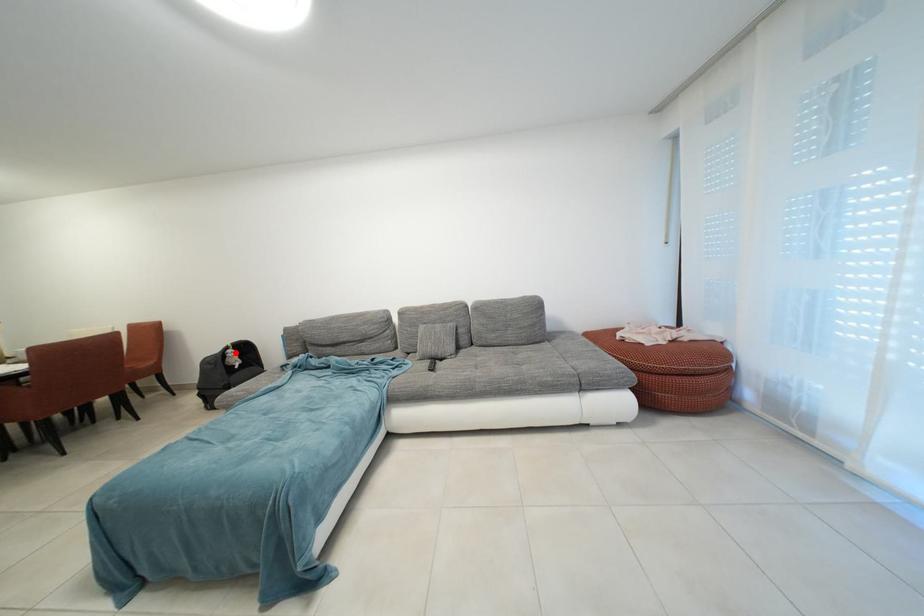
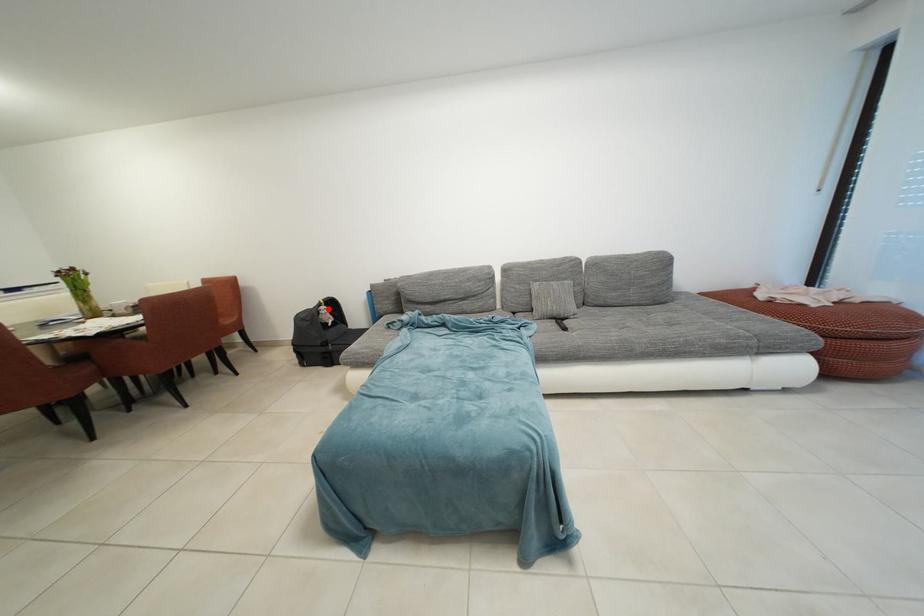
I am providing you with two images of the same scene from different viewpoints. A red point is marked on the first image and another point is marked on the second image. Are the points marked in image1 and image2 representing the same 3D position?

Yes